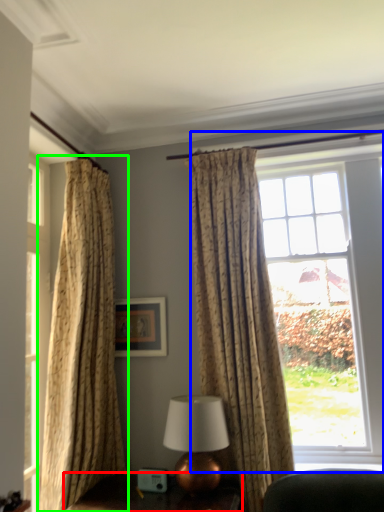
Question: Considering the real-world distances, which object is closest to furniture (highlighted by a red box)? window (highlighted by a blue box) or curtain (highlighted by a green box).

Choices:
 (A) window
 (B) curtain

Answer: (B)